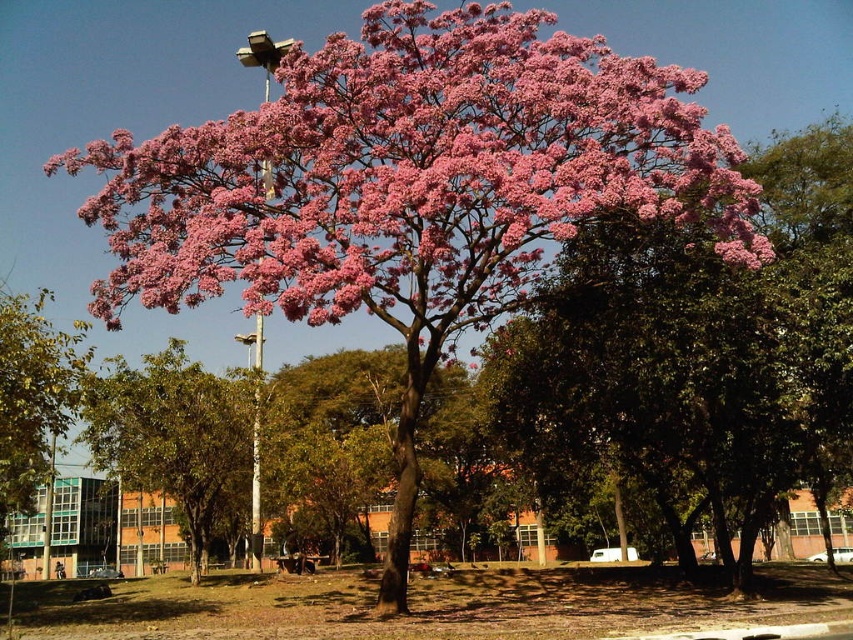
Is pink matte flower at upper center below green leafy tree at lower left?

Incorrect, pink matte flower at upper center is not positioned below green leafy tree at lower left.

Locate an element on the screen. This screenshot has width=853, height=640. pink matte flower at upper center is located at coordinates (412, 173).